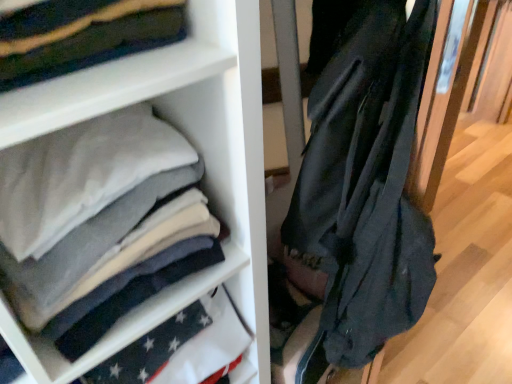
Find the location of a particular element. This screenshot has height=384, width=512. black matte jacket at right is located at coordinates (366, 183).

Measure the distance between black matte jacket at right and camera.

A distance of 59.28 centimeters exists between black matte jacket at right and camera.

Describe the element at coordinates (366, 183) in the screenshot. I see `black matte jacket at right` at that location.

Describe the element at coordinates (184, 134) in the screenshot. The height and width of the screenshot is (384, 512). I see `white fabric at center` at that location.

What is the approximate width of white fabric at center?

It is 32.04 centimeters.

I want to click on white fabric at center, so click(x=184, y=134).

Identify the location of black matte jacket at right. (366, 183).

Is black matte jacket at right to the left of white fabric at center from the viewer's perspective?

In fact, black matte jacket at right is to the right of white fabric at center.

Considering their positions, is black matte jacket at right located in front of or behind white fabric at center?

In the image, black matte jacket at right appears in front of white fabric at center.

Does point (411, 237) appear closer or farther from the camera than point (133, 96)?

Point (411, 237) appears to be farther away from the viewer than point (133, 96).

From the image's perspective, is black matte jacket at right positioned above or below white fabric at center?

black matte jacket at right is below white fabric at center.

In the scene shown: From a real-world perspective, between black matte jacket at right and white fabric at center, who is vertically lower?

black matte jacket at right is physically lower.

In terms of width, does black matte jacket at right look wider or thinner when compared to white fabric at center?

Clearly, black matte jacket at right has more width compared to white fabric at center.

Does black matte jacket at right have a greater height compared to white fabric at center?

Yes.

Who is bigger, black matte jacket at right or white fabric at center?

black matte jacket at right is bigger.

Is black matte jacket at right inside or outside of white fabric at center?

black matte jacket at right is not enclosed by white fabric at center.

Can you see black matte jacket at right touching white fabric at center?

They are not placed beside each other.

Is black matte jacket at right positioned with its back to white fabric at center?

No, black matte jacket at right's orientation is not away from white fabric at center.

How different are the orientations of black matte jacket at right and white fabric at center in degrees?

23.8 degrees.

This screenshot has height=384, width=512. Find the location of `garment on the right of white fabric at center`. garment on the right of white fabric at center is located at coordinates (366, 183).

Which object is positioned more to the right, white fabric at center or black matte jacket at right?

black matte jacket at right is more to the right.

Considering the positions of objects white fabric at center and black matte jacket at right in the image provided, who is behind, white fabric at center or black matte jacket at right?

white fabric at center is behind.

Which is nearer, (189, 110) or (342, 69)?

The point (342, 69) is more forward.

From the image's perspective, between white fabric at center and black matte jacket at right, who is located below?

black matte jacket at right, from the image's perspective.

From a real-world perspective, between white fabric at center and black matte jacket at right, who is vertically higher?

In real-world perspective, white fabric at center is above.

Considering the sizes of white fabric at center and black matte jacket at right in the image, is white fabric at center wider or thinner than black matte jacket at right?

In the image, white fabric at center appears to be more narrow than black matte jacket at right.

Can you confirm if white fabric at center is taller than black matte jacket at right?

In fact, white fabric at center may be shorter than black matte jacket at right.

Which of these two, white fabric at center or black matte jacket at right, is bigger?

black matte jacket at right.

Would you say white fabric at center contains black matte jacket at right?

No, black matte jacket at right is not surrounded by white fabric at center.

Are white fabric at center and black matte jacket at right beside each other?

No, white fabric at center is not in contact with black matte jacket at right.

Is white fabric at center positioned with its back to black matte jacket at right?

No, white fabric at center is not facing the opposite direction of black matte jacket at right.

Can you tell me how much white fabric at center and black matte jacket at right differ in facing direction?

23.8 degrees.

How distant is white fabric at center from black matte jacket at right?

8.72 inches.

This screenshot has width=512, height=384. Find the location of `garment on the right side of white fabric at center`. garment on the right side of white fabric at center is located at coordinates (366, 183).

Identify the location of garment lying in front of the white fabric at center. The width and height of the screenshot is (512, 384). (366, 183).

Find the location of a particular element. Image resolution: width=512 pixels, height=384 pixels. shelf above the black matte jacket at right (from a real-world perspective) is located at coordinates (184, 134).